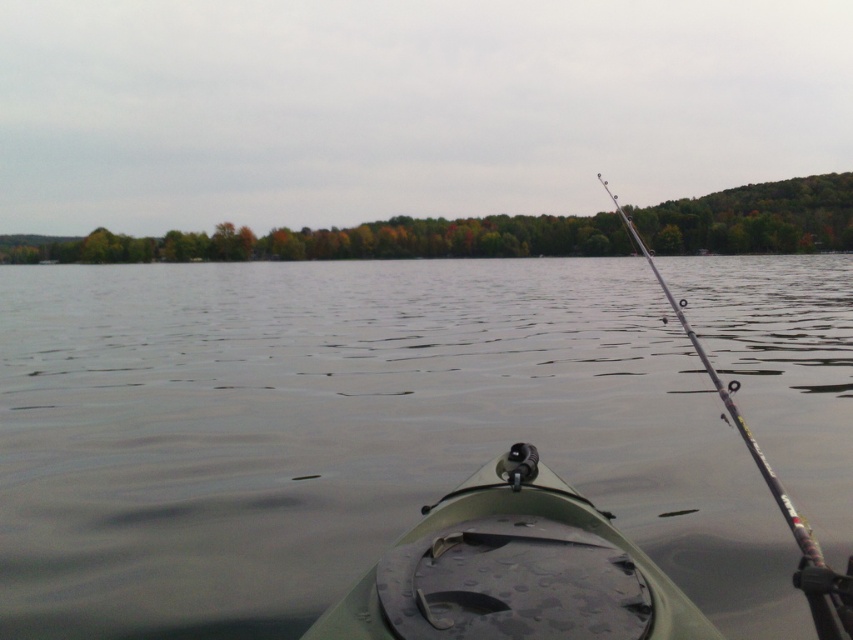
You are navigating a kayak and need to position it precisely for a photo. According to the coordinates provided, where exactly is the green matte kayak at center located?

The green matte kayak at center is located at coordinates point (514, 570).

You are in a kayak and want to retrieve the silver metallic rod at right from under the transparent water at center. Can you reach it without moving the kayak?

The transparent water at center is positioned over the silver metallic rod at right, so the rod is submerged under the water. You would need to move the kayak or use a tool to reach it since it is underwater.